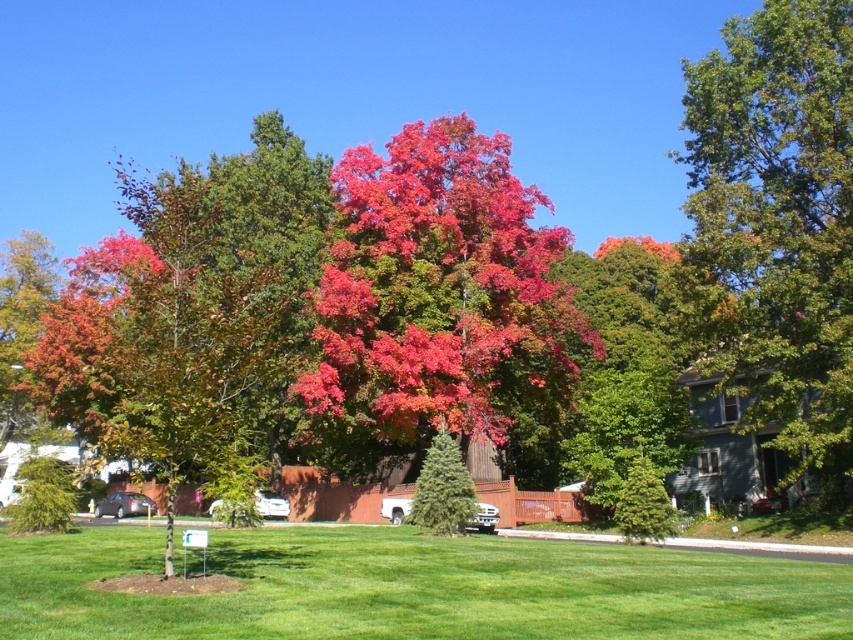
You are planning to plant a new tree in your backyard and want to ensure it gets enough sunlight. You notice the bright red maple at center and the green glossy tree at upper right in the scene. Which tree is casting a shadow over the other, potentially blocking sunlight?

The green glossy tree at upper right is casting a shadow over the bright red maple at center because the bright red maple at center is positioned under it.

You are standing in the autumn scene and want to place a decorative rock at the point marked by coordinates point (503,419). If your current position is 1.7 meters tall, can you reach that point without moving your feet?

The point (503,419) is 38.14 meters away from the viewer. Since this distance is much greater than the typical reach of a person, you cannot reach that point without moving your feet.